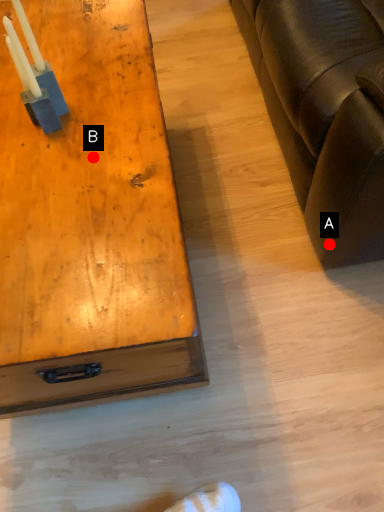
Question: Two points are circled on the image, labeled by A and B beside each circle. Which of the following is the closest to the observer?

Choices:
 (A) A is closer
 (B) B is closer

Answer: (B)